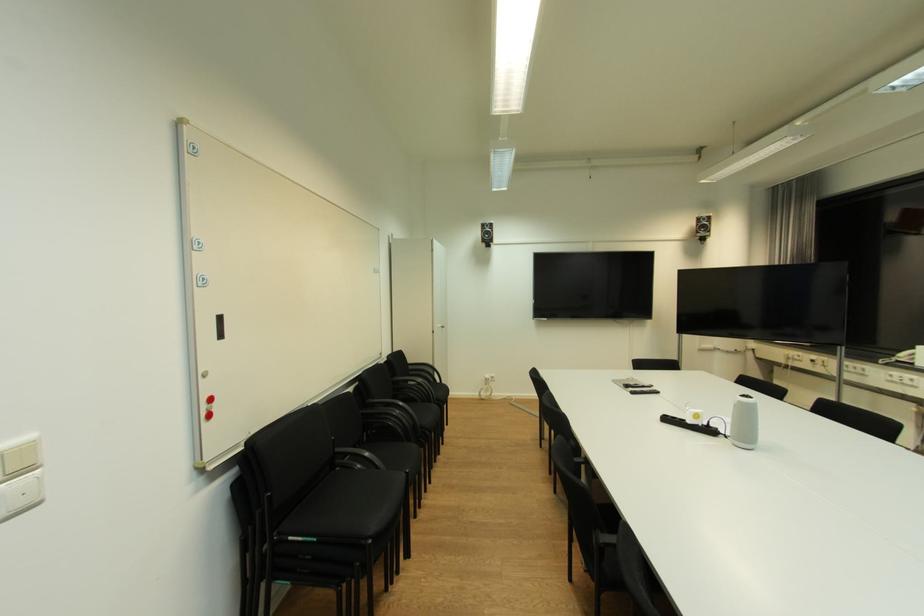
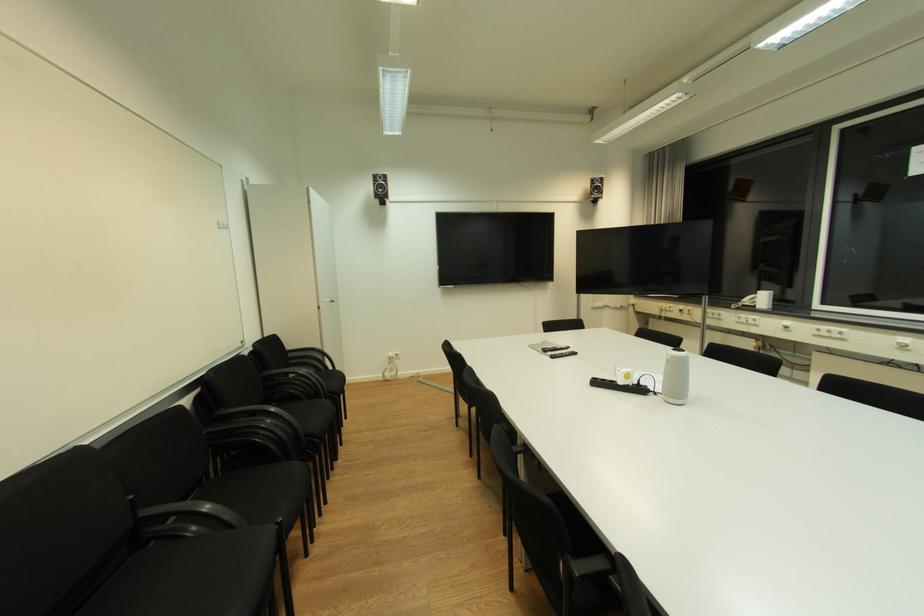
Question: I am providing you with two images of the same scene from different viewpoints. Please identify which objects are invisible in image2.

Choices:
 (A) black remote control
 (B) white cylindrical speaker
 (C) black chair armrest
 (D) none of these

Answer: (D)